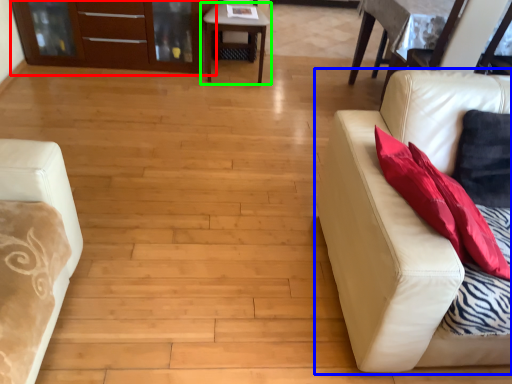
Question: Which is nearer to the dresser (highlighted by a red box)? studio couch (highlighted by a blue box) or table (highlighted by a green box).

Choices:
 (A) studio couch
 (B) table

Answer: (B)